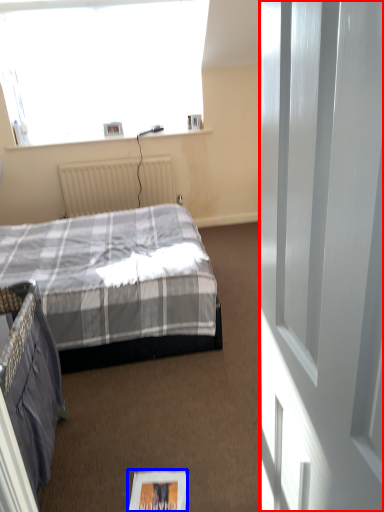
Question: Which object appears farthest to the camera in this image, screen door (highlighted by a red box) or magazine (highlighted by a blue box)?

Choices:
 (A) screen door
 (B) magazine

Answer: (B)